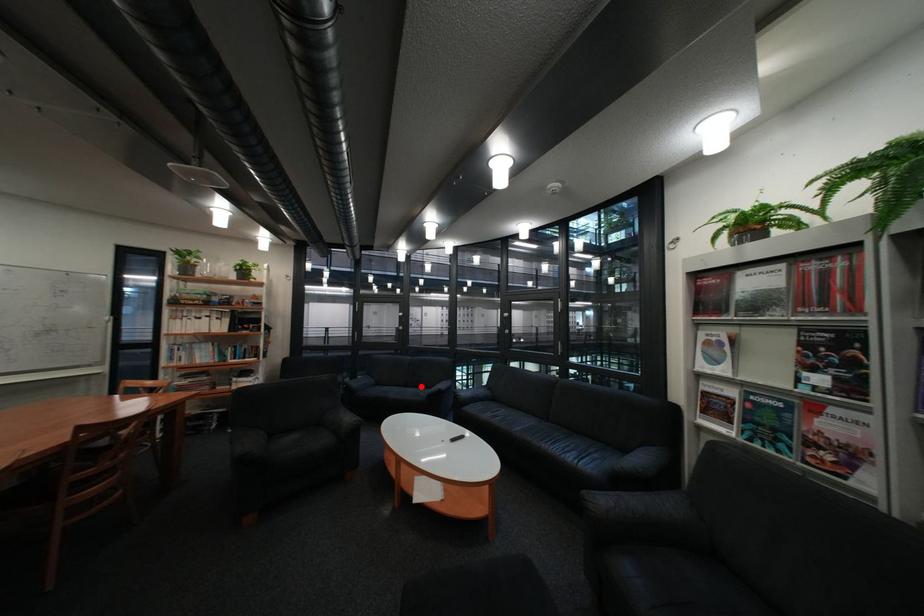
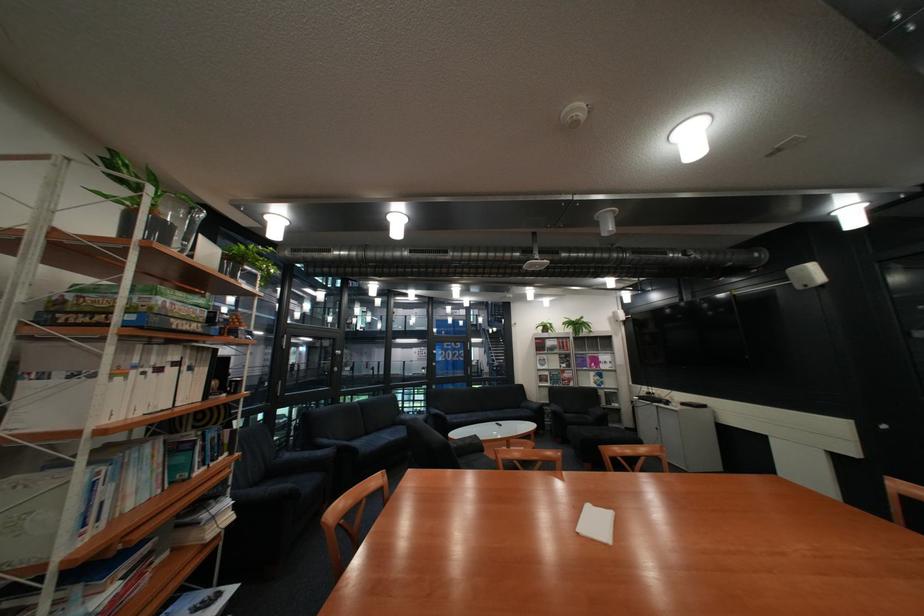
Locate, in the second image, the point that corresponds to the highlighted location in the first image.

(383, 434)